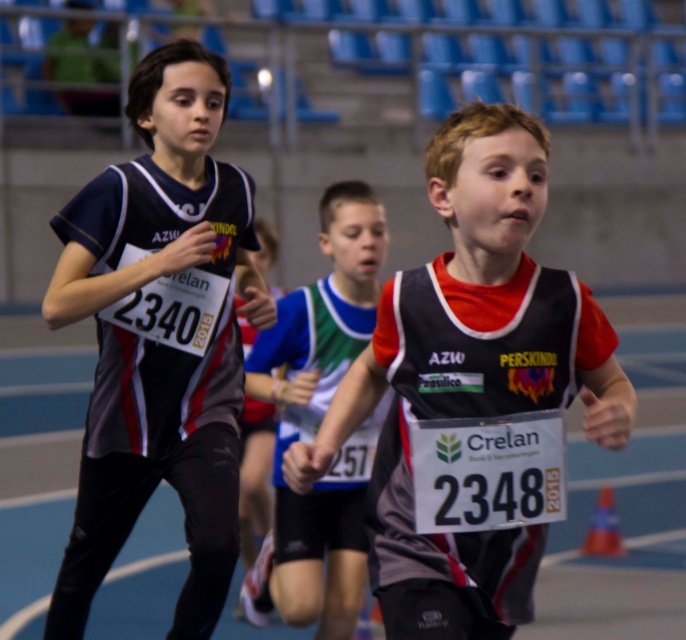
Is matte black jersey at center further to camera compared to white fabric shirt at center?

No, matte black jersey at center is closer to the viewer.

Does point (78, 596) lie behind point (355, 189)?

No, it is not.

Locate an element on the screen. Image resolution: width=686 pixels, height=640 pixels. matte black jersey at center is located at coordinates (158, 337).

Looking at this image, is matte black jersey at center to the left of matte black vest at center from the viewer's perspective?

Indeed, matte black jersey at center is positioned on the left side of matte black vest at center.

Does matte black jersey at center appear over matte black vest at center?

Yes.

Is point (220, 164) behind point (366, 352)?

That is True.

Where is `matte black jersey at center`? matte black jersey at center is located at coordinates (158, 337).

Who is positioned more to the left, matte black vest at center or white fabric shirt at center?

→ From the viewer's perspective, white fabric shirt at center appears more on the left side.

Is matte black vest at center bigger than white fabric shirt at center?

Actually, matte black vest at center might be smaller than white fabric shirt at center.

This screenshot has height=640, width=686. In order to click on matte black vest at center in this screenshot , I will do `click(471, 376)`.